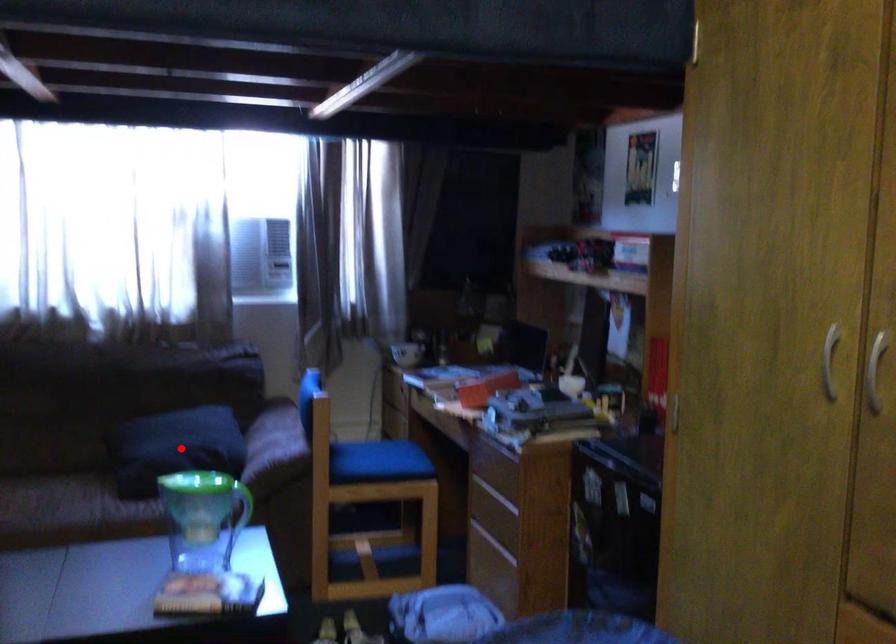
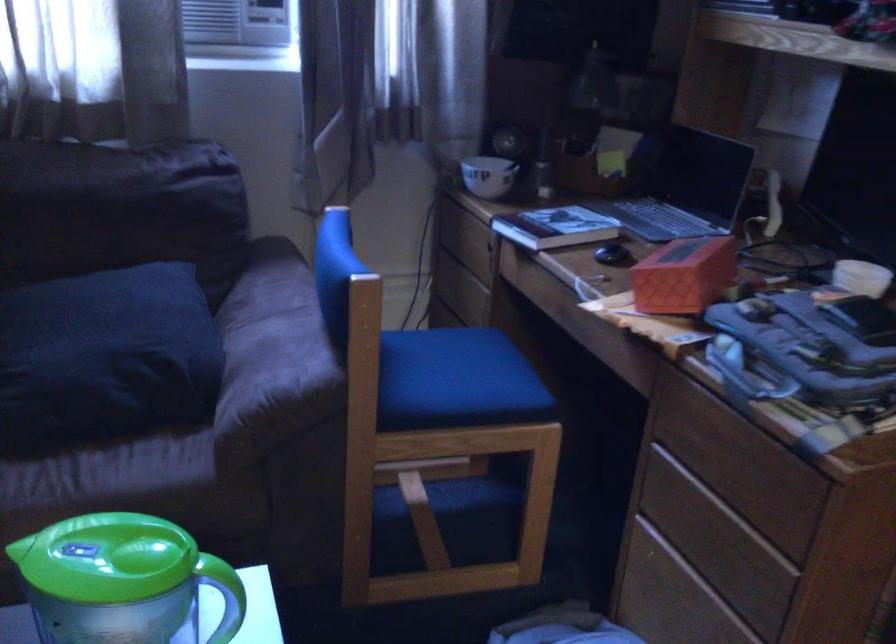
Question: A red point is marked in image1. In image2, is the corresponding 3D point closer to the camera or farther? Reply with the corresponding letter.

Choices:
 (A) The corresponding 3D point is closer.
 (B) The corresponding 3D point is farther.

Answer: (A)